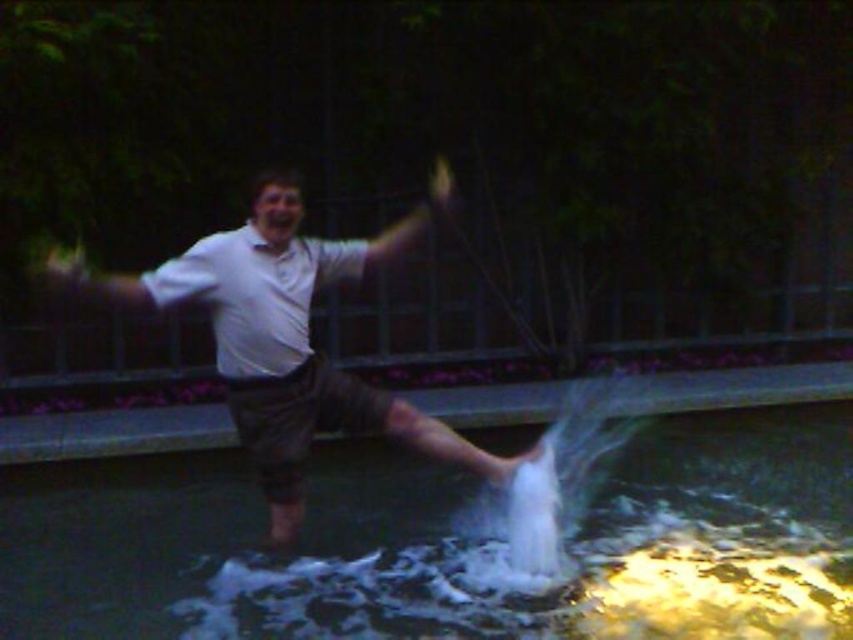
Between white frothy water at center and white cotton shirt at center, which one is positioned higher?

white cotton shirt at center

Does white frothy water at center appear on the left side of white cotton shirt at center?

Incorrect, white frothy water at center is not on the left side of white cotton shirt at center.

Locate an element on the screen. The width and height of the screenshot is (853, 640). white frothy water at center is located at coordinates (450, 545).

I want to click on white frothy water at center, so tap(450, 545).

Between white frothy water at center and white frothy water at lower center, which one has less height?

Standing shorter between the two is white frothy water at center.

Between point (827, 470) and point (543, 486), which one is positioned in front?

Positioned in front is point (543, 486).

Which is behind, point (21, 627) or point (556, 508)?

The point (556, 508) is more distant.

Find the location of `white frothy water at center`. white frothy water at center is located at coordinates (450, 545).

Is the position of white cotton shirt at center more distant than that of white frothy water at lower center?

No.

In the scene shown: Does white cotton shirt at center have a greater width compared to white frothy water at lower center?

Yes.

Who is more distant from viewer, (409, 408) or (572, 468)?

Point (572, 468)

This screenshot has height=640, width=853. In order to click on white cotton shirt at center in this screenshot , I will do `click(287, 337)`.